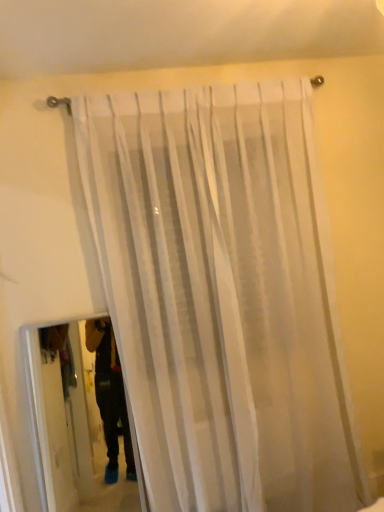
Where is `sheer white curtain at center`? The image size is (384, 512). sheer white curtain at center is located at coordinates (222, 295).

Measure the distance between sheer white curtain at center and camera.

The depth of sheer white curtain at center is 1.90 meters.

What do you see at coordinates (222, 295) in the screenshot? I see `sheer white curtain at center` at bounding box center [222, 295].

Where is `sheer white curtain at center`? This screenshot has width=384, height=512. sheer white curtain at center is located at coordinates (222, 295).